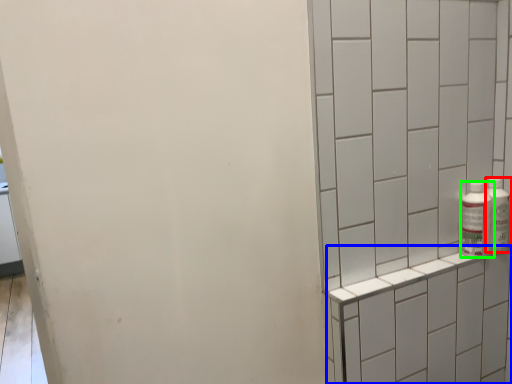
Question: Considering the real-world distances, which object is closest to bottle (highlighted by a red box)? shelf (highlighted by a blue box) or bottle (highlighted by a green box).

Choices:
 (A) shelf
 (B) bottle

Answer: (B)